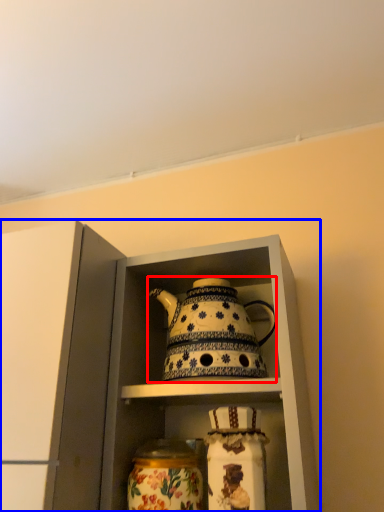
Question: Which object is further to the camera taking this photo, kettle (highlighted by a red box) or cabinetry (highlighted by a blue box)?

Choices:
 (A) kettle
 (B) cabinetry

Answer: (A)